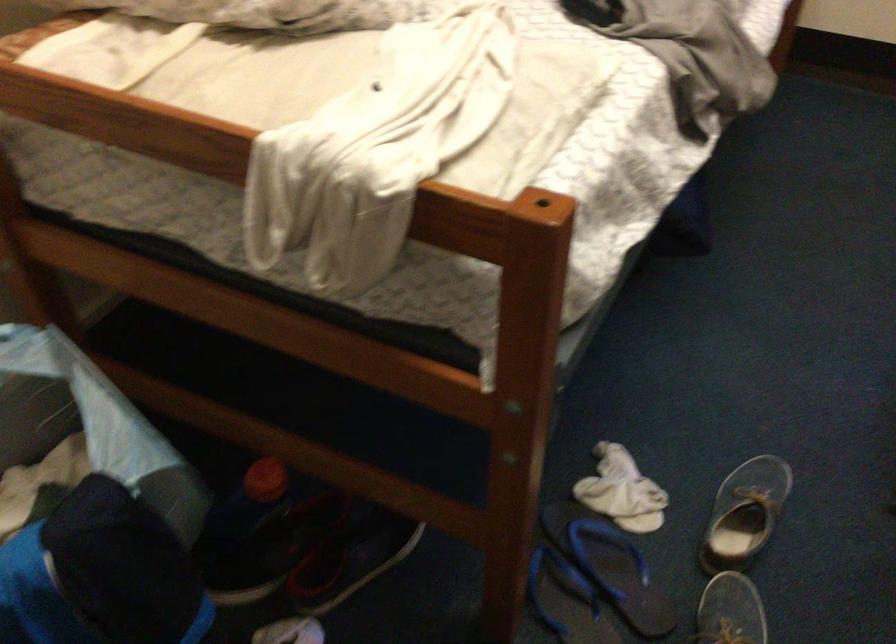
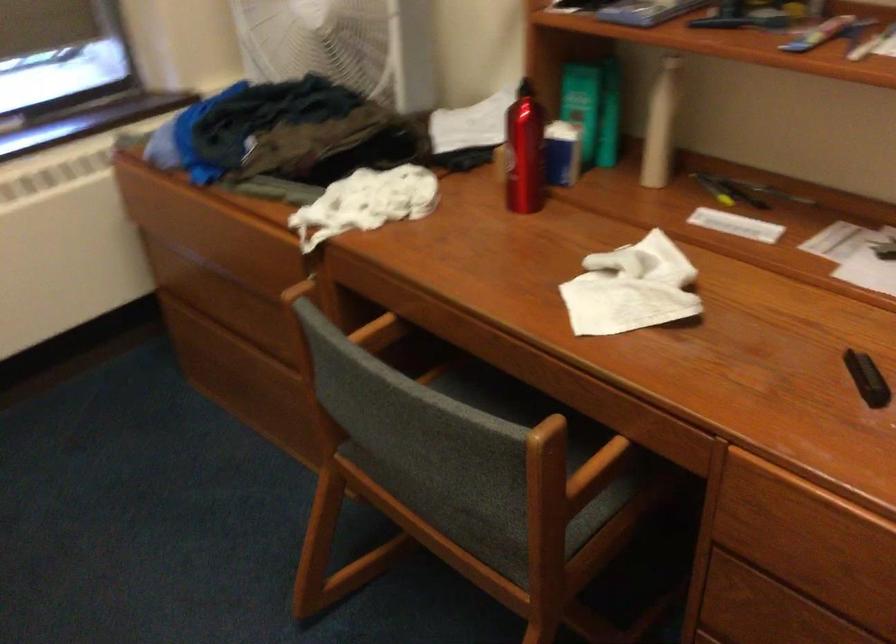
Question: The camera is either moving clockwise (left) or counter-clockwise (right) around the object. The first image is from the beginning of the video and the second image is from the end. Is the camera moving left or right when shooting the video?

Choices:
 (A) Left
 (B) Right

Answer: (A)